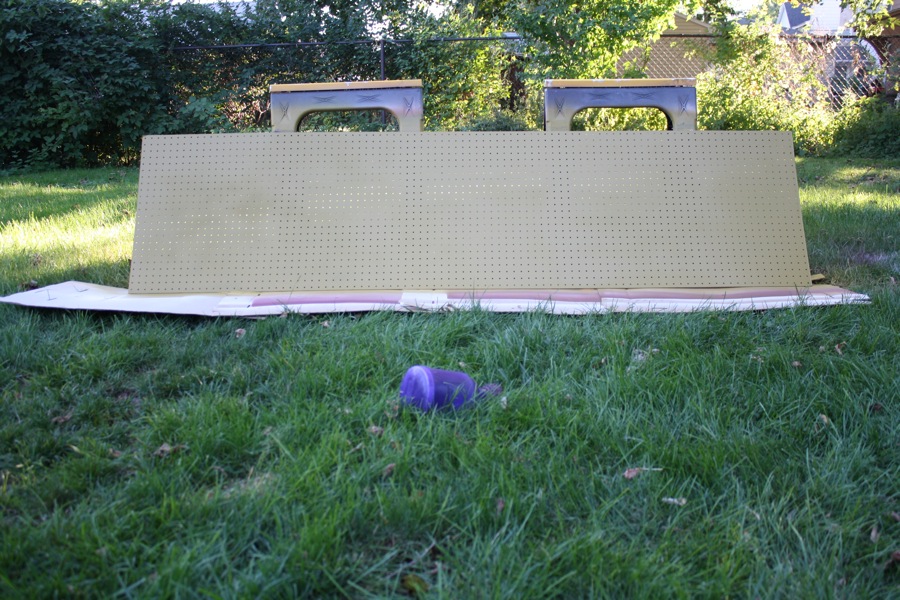
Find the location of `light gray board`. light gray board is located at coordinates (84, 297), (187, 305), (789, 302), (634, 302).